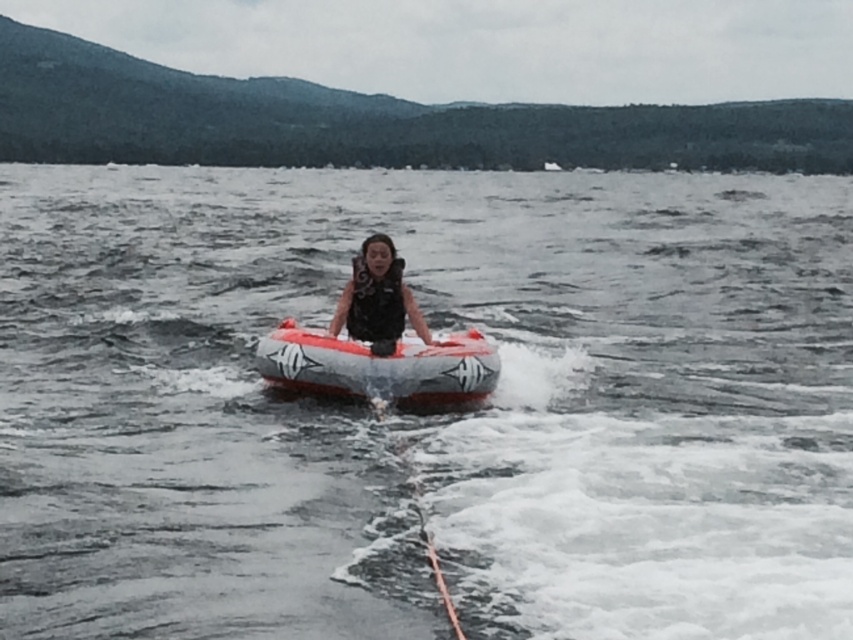
Is black matte life vest at center closer to camera compared to black matte life jacket at center?

No.

Who is more forward, (358, 256) or (383, 328)?

Point (358, 256) is in front.

Locate an element on the screen. This screenshot has height=640, width=853. black matte life vest at center is located at coordinates (376, 296).

Is the position of white foam water at center less distant than that of black matte life jacket at center?

Yes, it is.

Does white foam water at center have a lesser height compared to black matte life jacket at center?

In fact, white foam water at center may be taller than black matte life jacket at center.

Measure the distance between point (637, 264) and camera.

Point (637, 264) is 27.34 meters from camera.

The image size is (853, 640). I want to click on white foam water at center, so click(x=426, y=417).

Between white foam water at center and black matte life vest at center, which one is positioned lower?

Positioned lower is black matte life vest at center.

Does white foam water at center have a smaller size compared to black matte life vest at center?

No, white foam water at center is not smaller than black matte life vest at center.

The height and width of the screenshot is (640, 853). What do you see at coordinates (426, 417) in the screenshot?
I see `white foam water at center` at bounding box center [426, 417].

I want to click on white foam water at center, so click(x=426, y=417).